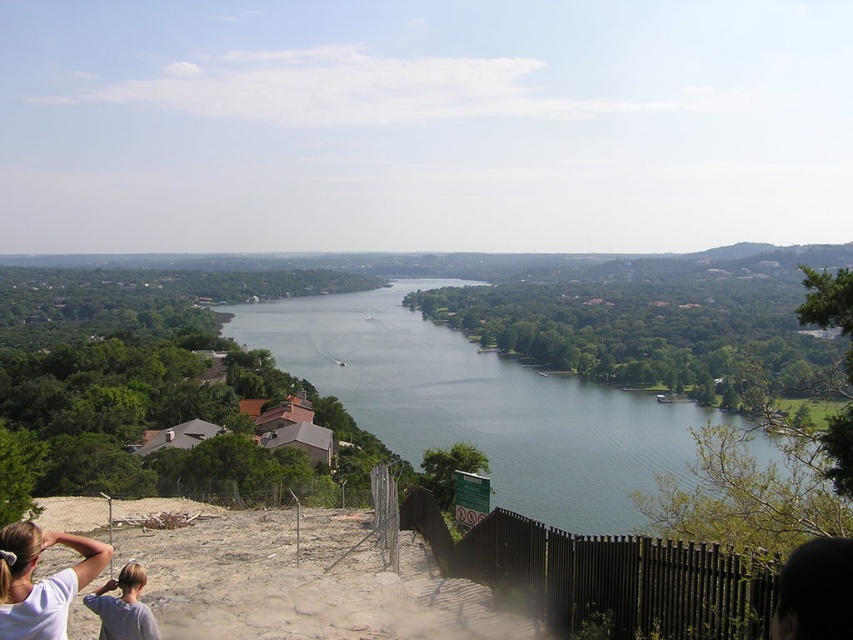
At what (x,y) coordinates should I click in order to perform the action: click on green water at center. Please return your answer as a coordinate pair (x, y). The width and height of the screenshot is (853, 640). Looking at the image, I should click on (485, 404).

Which of these two, green water at center or white matte shirt at lower left, stands shorter?

Standing shorter between the two is white matte shirt at lower left.

Describe the element at coordinates (485, 404) in the screenshot. I see `green water at center` at that location.

Locate an element on the screen. green water at center is located at coordinates (485, 404).